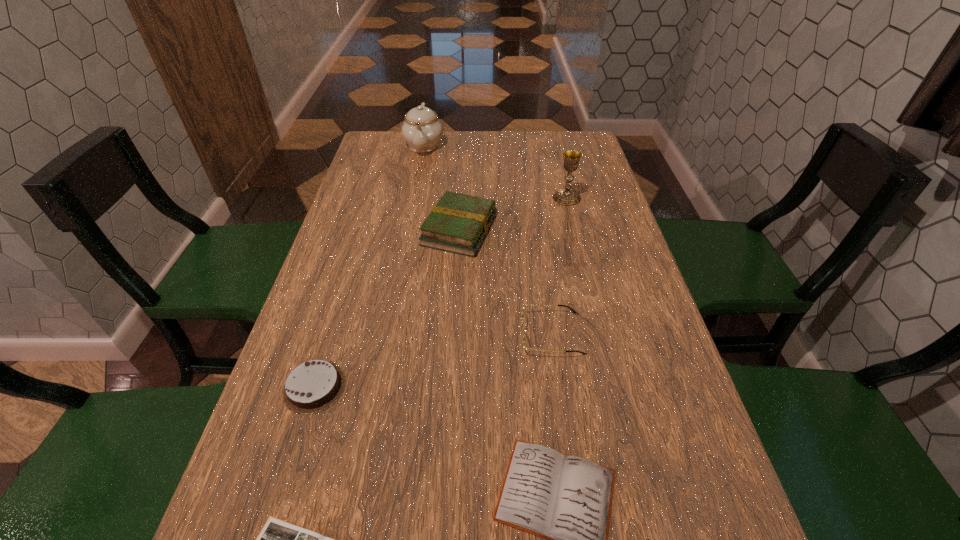
Find the location of `the farthest object`. the farthest object is located at coordinates (422, 130).

Find the location of a particular element. The width and height of the screenshot is (960, 540). chalice is located at coordinates (567, 197).

Where is `the fifth shortest object`? The height and width of the screenshot is (540, 960). the fifth shortest object is located at coordinates (458, 223).

Image resolution: width=960 pixels, height=540 pixels. What are the coordinates of `the taller book` in the screenshot? It's located at (458, 223).

Locate an element on the screen. spectacles is located at coordinates (525, 333).

I want to click on the fourth farthest object, so click(525, 333).

Find the location of a particular element. The image size is (960, 540). the third shortest object is located at coordinates (x=313, y=386).

The height and width of the screenshot is (540, 960). Identify the location of the third nearest object. (313, 386).

The image size is (960, 540). I want to click on free space located 0.080m at the spout of the chinaware, so click(419, 173).

Where is `vacant space situated 0.360m on the back of the chalice`? The image size is (960, 540). vacant space situated 0.360m on the back of the chalice is located at coordinates (551, 134).